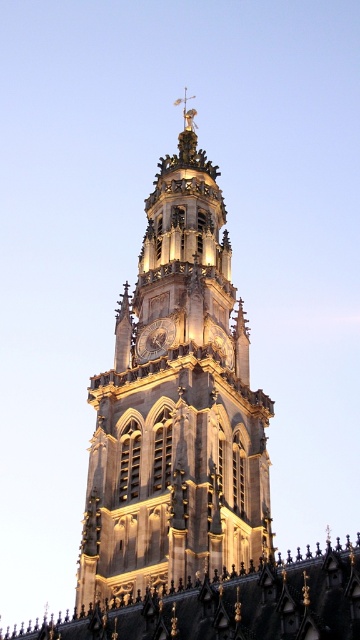
Question: Which point appears farthest from the camera in this image?

Choices:
 (A) (206, 401)
 (B) (147, 332)

Answer: (B)

Question: Is golden stone tower at center to the left of golden metallic clock at center from the viewer's perspective?

Choices:
 (A) no
 (B) yes

Answer: (A)

Question: Does golden stone tower at center appear under golden metallic clock at center?

Choices:
 (A) yes
 (B) no

Answer: (B)

Question: Can you confirm if golden stone tower at center is positioned to the left of golden metallic clock at center?

Choices:
 (A) yes
 (B) no

Answer: (B)

Question: Which point is farther from the camera taking this photo?

Choices:
 (A) (218, 561)
 (B) (150, 326)

Answer: (B)